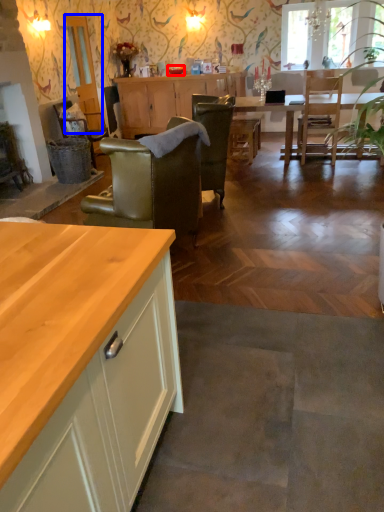
Question: Which point is further to the camera, tableware (highlighted by a red box) or glass door (highlighted by a blue box)?

Choices:
 (A) tableware
 (B) glass door

Answer: (A)